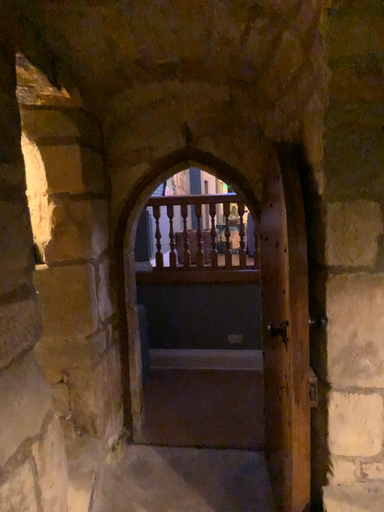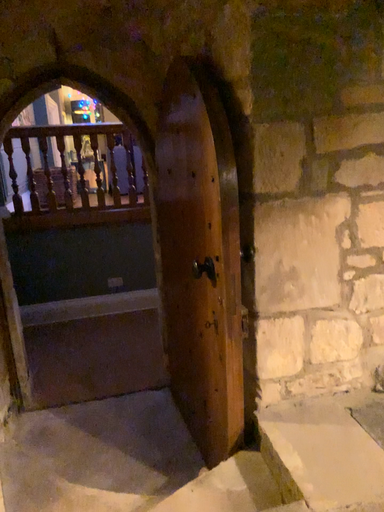
Question: How did the camera likely rotate when shooting the video?

Choices:
 (A) rotated left
 (B) rotated right

Answer: (B)